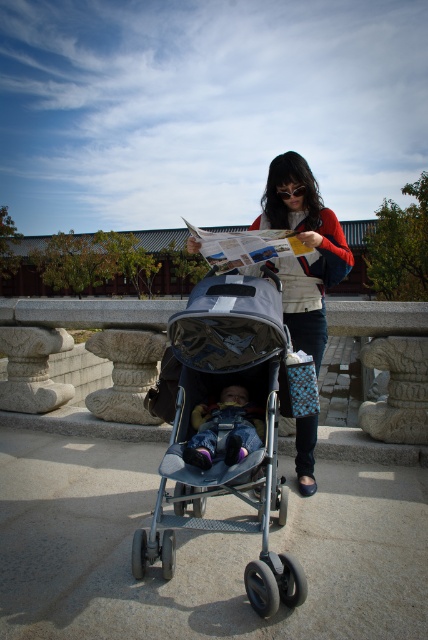
Does gray matte stroller at center have a larger size compared to matte white jacket at center?

Yes, gray matte stroller at center is bigger than matte white jacket at center.

Between gray matte stroller at center and matte white jacket at center, which one has more height?

matte white jacket at center is taller.

Is point (193, 314) positioned before point (297, 465)?

That is True.

Identify the location of gray matte stroller at center. This screenshot has width=428, height=640. (226, 429).

What are the coordinates of `gray matte stroller at center` in the screenshot? It's located at click(x=226, y=429).

Looking at this image, is matte white jacket at center taller than denim pants at center?

Indeed, matte white jacket at center has a greater height compared to denim pants at center.

Does matte white jacket at center appear on the right side of denim pants at center?

Correct, you'll find matte white jacket at center to the right of denim pants at center.

What do you see at coordinates (306, 246) in the screenshot?
I see `matte white jacket at center` at bounding box center [306, 246].

You are a GUI agent. You are given a task and a screenshot of the screen. Output one action in this format:
    pyautogui.click(x=<x>, y=<y>)
    Task: Click on the matte white jacket at center
    This screenshot has width=428, height=640.
    Given the screenshot: What is the action you would take?
    [x=306, y=246]